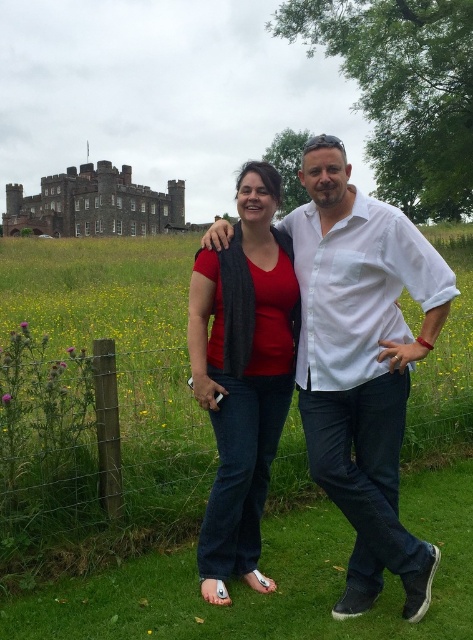
Question: Among these objects, which one is farthest from the camera?

Choices:
 (A) wire mesh fence at lower center
 (B) matte red shirt at center
 (C) white cotton shirt at center

Answer: (A)

Question: Based on their relative distances, which object is nearer to the white cotton shirt at center?

Choices:
 (A) matte red shirt at center
 (B) dark gray stone castle at upper left
 (C) wire mesh fence at lower center

Answer: (A)

Question: Which point is closer to the camera taking this photo?

Choices:
 (A) (401, 560)
 (B) (123, 372)
 (C) (251, 257)

Answer: (A)

Question: Can you confirm if wire mesh fence at lower center is positioned below matte red shirt at center?

Choices:
 (A) yes
 (B) no

Answer: (A)

Question: Can you confirm if wire mesh fence at lower center is thinner than dark gray stone castle at upper left?

Choices:
 (A) yes
 (B) no

Answer: (A)

Question: Is wire mesh fence at lower center further to the viewer compared to matte red shirt at center?

Choices:
 (A) no
 (B) yes

Answer: (B)